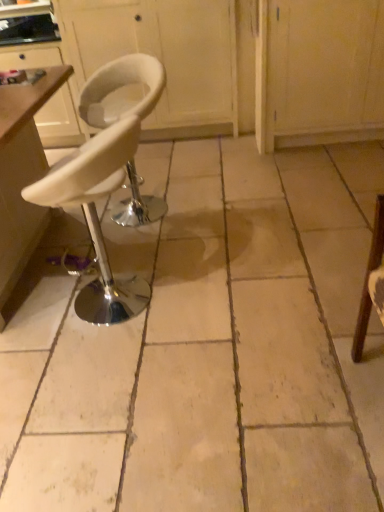
Identify the location of free location in front of white matte stool at left, the second chair in the back-to-front sequence. (112, 375).